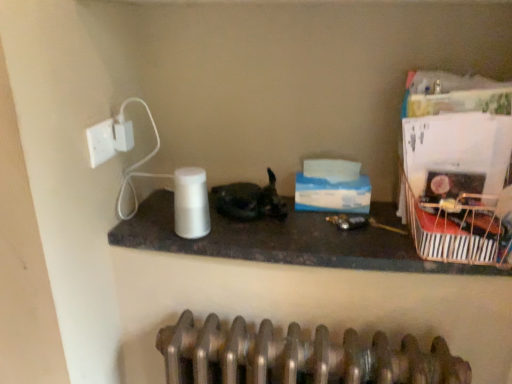
Identify the location of vacant area that is situated to the right of white matte paper towel at center. (261, 232).